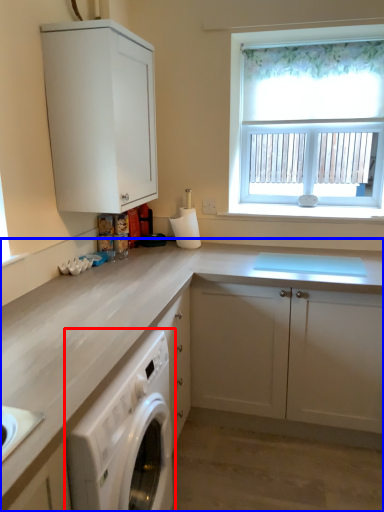
Question: Among these objects, which one is farthest to the camera, home appliance (highlighted by a red box) or cabinetry (highlighted by a blue box)?

Choices:
 (A) home appliance
 (B) cabinetry

Answer: (B)